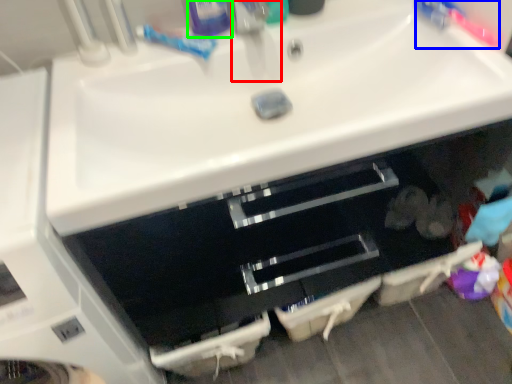
Question: Which is nearer to the faucet (highlighted by a red box)? toothbrush (highlighted by a blue box) or toiletry (highlighted by a green box).

Choices:
 (A) toothbrush
 (B) toiletry

Answer: (B)